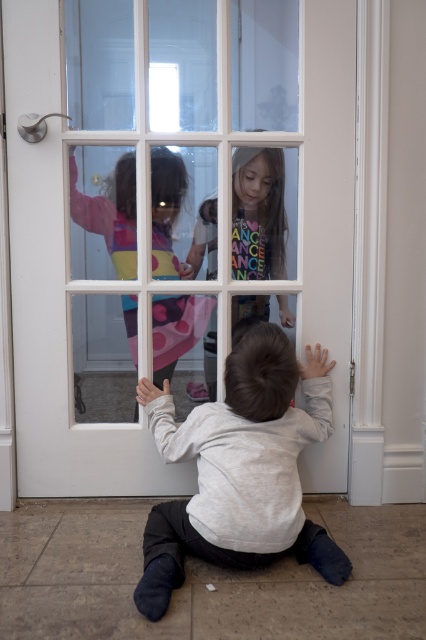
Can you confirm if white glass door at center is wider than matte pink dress at upper center?

Yes, white glass door at center is wider than matte pink dress at upper center.

Does white glass door at center have a greater height compared to matte pink dress at upper center?

Indeed, white glass door at center has a greater height compared to matte pink dress at upper center.

Based on the photo, who is more distant from viewer, (x=169, y=324) or (x=115, y=221)?

Point (x=169, y=324)

Where is `white glass door at center`? The width and height of the screenshot is (426, 640). white glass door at center is located at coordinates (170, 218).

Is point (275, 538) farther from camera compared to point (123, 252)?

No, (275, 538) is in front of (123, 252).

Does gray cotton shirt at lower center have a larger size compared to matte pink dress at upper center?

Yes.

Locate an element on the screen. This screenshot has height=640, width=426. gray cotton shirt at lower center is located at coordinates (241, 468).

Is white glass door at center taller than gray cotton shirt at lower center?

Yes.

Is white glass door at center bigger than gray cotton shirt at lower center?

Correct, white glass door at center is larger in size than gray cotton shirt at lower center.

Where is `white glass door at center`? This screenshot has height=640, width=426. white glass door at center is located at coordinates (170, 218).

Locate an element on the screen. This screenshot has height=640, width=426. white glass door at center is located at coordinates (170, 218).